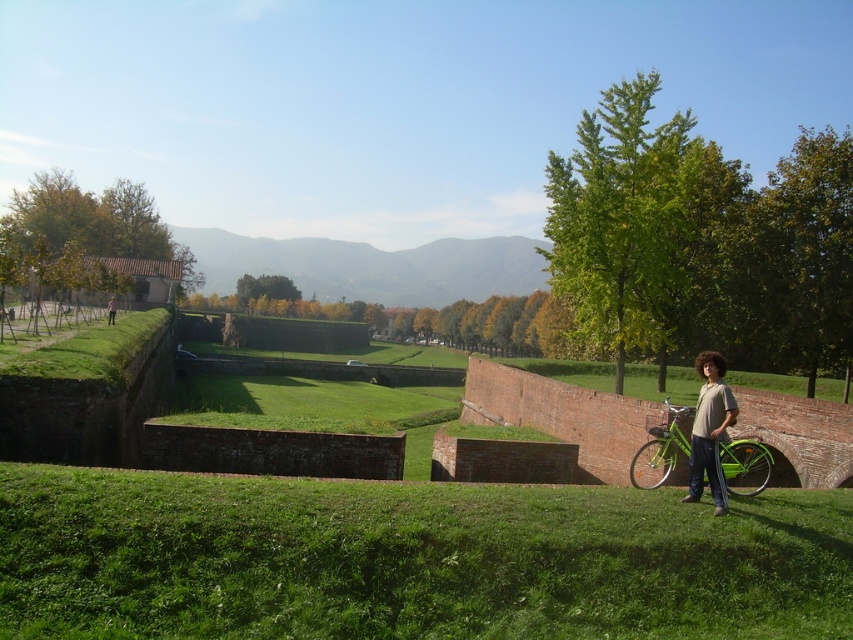
Question: Does green grassy hillside at center appear over light brown wooden fence at upper left?

Choices:
 (A) yes
 (B) no

Answer: (A)

Question: Which of the following is the closest to the observer?

Choices:
 (A) (839, 564)
 (B) (730, 394)
 (C) (485, 240)

Answer: (A)

Question: Is green grassy at lower center wider than light brown wooden fence at upper left?

Choices:
 (A) yes
 (B) no

Answer: (A)

Question: Among these objects, which one is farthest from the camera?

Choices:
 (A) green matte bicycle at lower right
 (B) light brown cotton shirt at lower right
 (C) light brown wooden fence at upper left

Answer: (C)

Question: Considering the real-world distances, which object is farthest from the green grassy hillside at center?

Choices:
 (A) light brown cotton shirt at lower right
 (B) light brown wooden fence at upper left

Answer: (A)

Question: Does green grassy hillside at center have a larger size compared to light brown wooden fence at upper left?

Choices:
 (A) no
 (B) yes

Answer: (B)